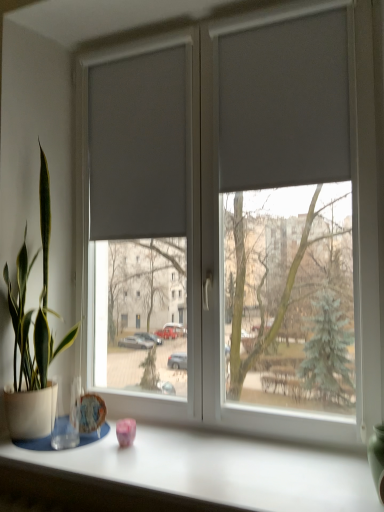
This screenshot has width=384, height=512. What do you see at coordinates (33, 336) in the screenshot?
I see `green glossy plant at left` at bounding box center [33, 336].

Locate an element on the screen. matte gray curtain at left, the 1th curtain when ordered from left to right is located at coordinates (138, 146).

Where is `green matte glass vase at right`? green matte glass vase at right is located at coordinates (377, 459).

Does matte gray curtain at upper right, marked as the 2th curtain in a left-to-right arrangement, have a lesser width compared to green glossy plant at left?

Correct, the width of matte gray curtain at upper right, marked as the 2th curtain in a left-to-right arrangement, is less than that of green glossy plant at left.

From the image's perspective, who appears lower, matte gray curtain at upper right, which is the 2th curtain in back-to-front order, or green glossy plant at left?

green glossy plant at left.

Considering the sizes of objects matte gray curtain at upper right, positioned as the 1th curtain in front-to-back order, and green glossy plant at left in the image provided, who is smaller, matte gray curtain at upper right, positioned as the 1th curtain in front-to-back order, or green glossy plant at left?

With smaller size is matte gray curtain at upper right, positioned as the 1th curtain in front-to-back order.

Locate an element on the screen. The height and width of the screenshot is (512, 384). curtain that is the 2nd one when counting upward from the green glossy plant at left (from the image's perspective) is located at coordinates (284, 104).

Which is behind, white matte table at lower center or matte gray blinds at center?

matte gray blinds at center.

Considering the relative positions of white matte table at lower center and matte gray blinds at center in the image provided, is white matte table at lower center to the right of matte gray blinds at center from the viewer's perspective?

In fact, white matte table at lower center is to the left of matte gray blinds at center.

Which is correct: white matte table at lower center is inside matte gray blinds at center, or outside of it?

white matte table at lower center exists outside the volume of matte gray blinds at center.

Which of these two, white matte table at lower center or matte gray blinds at center, is smaller?

white matte table at lower center.

Who is bigger, green glossy plant at left or white matte table at lower center?

green glossy plant at left.

Is green glossy plant at left to the left of white matte table at lower center from the viewer's perspective?

Yes, green glossy plant at left is to the left of white matte table at lower center.

From their relative heights in the image, would you say green glossy plant at left is taller or shorter than white matte table at lower center?

green glossy plant at left is taller than white matte table at lower center.

Find the location of `curtain that is the 2nd one above the white matte table at lower center (from a real-world perspective)`. curtain that is the 2nd one above the white matte table at lower center (from a real-world perspective) is located at coordinates (284, 104).

Can white matte table at lower center be found inside matte gray curtain at upper right, positioned as the 1th curtain in front-to-back order?

No, white matte table at lower center is located outside of matte gray curtain at upper right, positioned as the 1th curtain in front-to-back order.

Visually, is matte gray curtain at upper right, which is the 2th curtain in back-to-front order, positioned to the left or to the right of white matte table at lower center?

Clearly, matte gray curtain at upper right, which is the 2th curtain in back-to-front order, is on the right of white matte table at lower center in the image.

Is matte gray curtain at upper right, positioned as the 1th curtain in front-to-back order, positioned with its back to white matte table at lower center?

matte gray curtain at upper right, positioned as the 1th curtain in front-to-back order, does not have its back to white matte table at lower center.

How far apart are white matte table at lower center and matte gray curtain at left, which is the 2th curtain from front to back?

white matte table at lower center and matte gray curtain at left, which is the 2th curtain from front to back, are 3.62 feet apart from each other.

Consider the image. From a real-world perspective, is white matte table at lower center beneath matte gray curtain at left, the 1th curtain when ordered from left to right?

Indeed, from a real-world perspective, white matte table at lower center is positioned beneath matte gray curtain at left, the 1th curtain when ordered from left to right.

Considering the sizes of objects white matte table at lower center and matte gray curtain at left, which is the 2th curtain from front to back, in the image provided, who is thinner, white matte table at lower center or matte gray curtain at left, which is the 2th curtain from front to back,?

matte gray curtain at left, which is the 2th curtain from front to back.

Is matte gray curtain at left, which is counted as the second curtain, starting from the right, at the back of white matte table at lower center?

No, white matte table at lower center's orientation is not away from matte gray curtain at left, which is counted as the second curtain, starting from the right.

From the image's perspective, which one is positioned lower, matte gray blinds at center or white matte table at lower center?

From the image's view, white matte table at lower center is below.

Can you confirm if matte gray blinds at center is positioned to the right of white matte table at lower center?

Yes, matte gray blinds at center is to the right of white matte table at lower center.

You are a GUI agent. You are given a task and a screenshot of the screen. Output one action in this format:
    pyautogui.click(x=<x>, y=<y>)
    Task: Click on the window above the white matte table at lower center (from a real-world perspective)
    The height and width of the screenshot is (512, 384).
    Given the screenshot: What is the action you would take?
    pyautogui.click(x=236, y=222)

Does matte gray blinds at center have a greater height compared to white matte table at lower center?

Yes.

Considering the relative sizes of white matte table at lower center and green glossy plant at left in the image provided, is white matte table at lower center bigger than green glossy plant at left?

Actually, white matte table at lower center might be smaller than green glossy plant at left.

From the image's perspective, which object appears higher, white matte table at lower center or green glossy plant at left?

green glossy plant at left appears higher in the image.

Does point (308, 506) appear closer or farther from the camera than point (46, 259)?

Clearly, point (308, 506) is closer to the camera than point (46, 259).

The width and height of the screenshot is (384, 512). I want to click on houseplant beneath the matte gray curtain at upper right, which is the 2th curtain in back-to-front order (from a real-world perspective), so click(33, 336).

This screenshot has width=384, height=512. I want to click on table that is in front of the matte gray blinds at center, so click(219, 470).

When comparing their distances from matte gray curtain at upper right, which is the 2th curtain in back-to-front order, does green glossy plant at left or white matte table at lower center seem further?

Based on the image, white matte table at lower center appears to be further to matte gray curtain at upper right, which is the 2th curtain in back-to-front order.

Estimate the real-world distances between objects in this image. Which object is closer to green glossy plant at left, white matte table at lower center or matte gray blinds at center?

The object closer to green glossy plant at left is matte gray blinds at center.

Estimate the real-world distances between objects in this image. Which object is closer to green glossy plant at left, matte gray blinds at center or green matte glass vase at right?

The object closer to green glossy plant at left is matte gray blinds at center.

Based on their spatial positions, is green matte glass vase at right or white matte table at lower center further from green glossy plant at left?

Among the two, green matte glass vase at right is located further to green glossy plant at left.

From the picture: Based on their spatial positions, is matte gray curtain at left, the 1th curtain when ordered from back to front, or green matte glass vase at right closer to white matte table at lower center?

Among the two, green matte glass vase at right is located nearer to white matte table at lower center.

Estimate the real-world distances between objects in this image. Which object is further from matte gray curtain at left, the 1th curtain when ordered from left to right, matte gray blinds at center or green matte glass vase at right?

green matte glass vase at right.

Based on their spatial positions, is white matte table at lower center or matte gray curtain at left, the 1th curtain when ordered from back to front, closer to matte gray curtain at upper right, the first curtain viewed from the right?

matte gray curtain at left, the 1th curtain when ordered from back to front, is closer to matte gray curtain at upper right, the first curtain viewed from the right.

Which object lies nearer to the anchor point matte gray curtain at upper right, marked as the 2th curtain in a left-to-right arrangement, white matte table at lower center or green matte glass vase at right?

green matte glass vase at right lies closer to matte gray curtain at upper right, marked as the 2th curtain in a left-to-right arrangement, than the other object.

Where is `window between matte gray curtain at left, the 1th curtain when ordered from back to front, and green matte glass vase at right, in the vertical direction`? The image size is (384, 512). window between matte gray curtain at left, the 1th curtain when ordered from back to front, and green matte glass vase at right, in the vertical direction is located at coordinates (236, 222).

Identify the location of table located between green glossy plant at left and green matte glass vase at right in the left-right direction. (219, 470).

Where is `window between matte gray curtain at left, which is the 2th curtain from front to back, and green glossy plant at left in the up-down direction`? The height and width of the screenshot is (512, 384). window between matte gray curtain at left, which is the 2th curtain from front to back, and green glossy plant at left in the up-down direction is located at coordinates (236, 222).

Where is `curtain that lies between matte gray curtain at upper right, which is the 2th curtain in back-to-front order, and white matte table at lower center from top to bottom`? The image size is (384, 512). curtain that lies between matte gray curtain at upper right, which is the 2th curtain in back-to-front order, and white matte table at lower center from top to bottom is located at coordinates (138, 146).